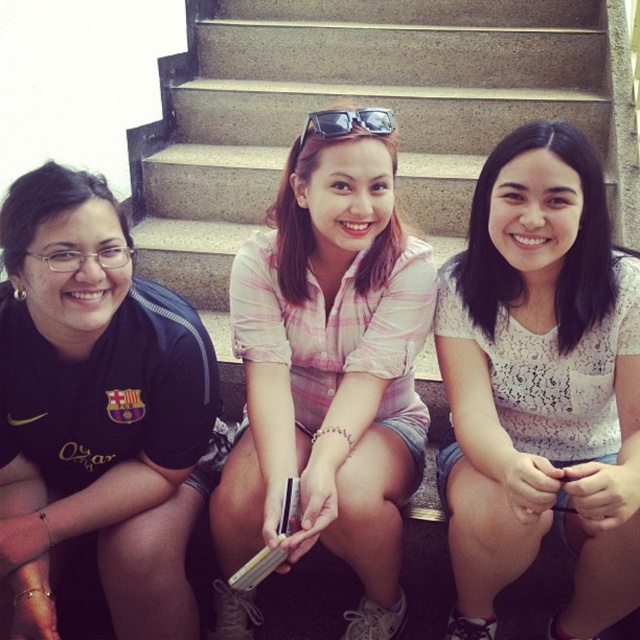
You are a fashion designer observing the two outfits at the center of the image. Which one is narrower in width between the white lace blouse at center and the pink plaid shirt at center?

The white lace blouse at center has a lesser width compared to the pink plaid shirt at center, so the white lace blouse at center is narrower in width.

Consider the image. Based on the scene description, which object is positioned higher between the white lace blouse at center and the black matte shirt at left?

The white lace blouse at center is positioned higher than the black matte shirt at left according to the description.

Based on the scene description, which object is taller between the white lace blouse at center and the black matte shirt at left?

The white lace blouse at center is taller than the black matte shirt at left.